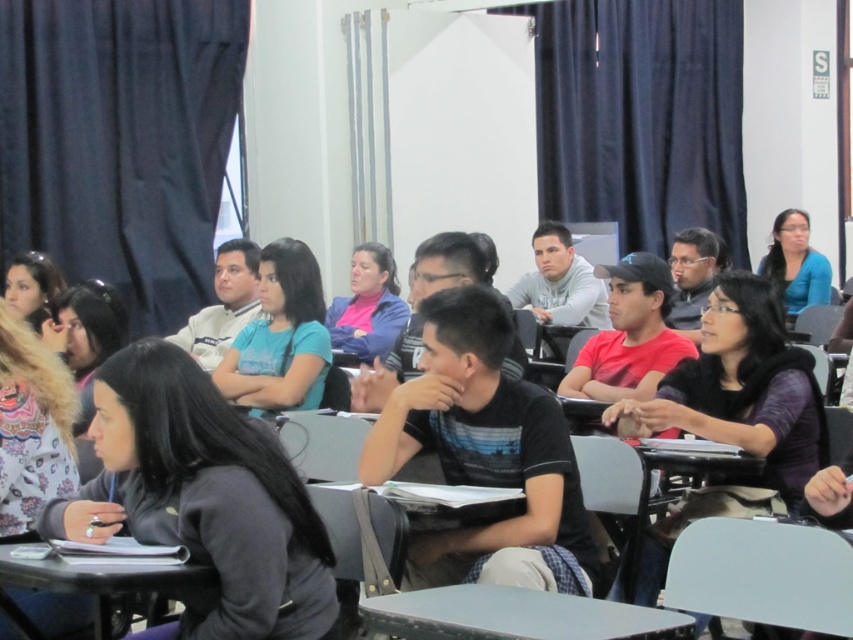
In the scene shown: Who is more forward, (566, 604) or (120, 570)?

Point (120, 570)

Can you confirm if smooth gray table at center is positioned to the left of smooth plastic table at lower left?

No, smooth gray table at center is not to the left of smooth plastic table at lower left.

Measure the distance between smooth gray table at center and camera.

smooth gray table at center is 7.01 feet from camera.

Locate an element on the screen. The image size is (853, 640). smooth gray table at center is located at coordinates (515, 616).